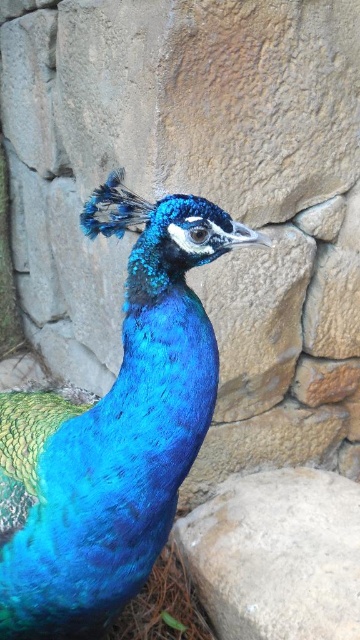
You are an artist trying to paint the scene. You need to decide which object to paint first based on their height. Which object should you start with, the shiny blue peacock at center or the gray rough stone at center?

The shiny blue peacock at center is taller than the gray rough stone at center, so you should start painting the shiny blue peacock at center first to ensure proper placement and proportions.

Based on the coordinates provided, where is the shiny blue peacock at center located in the image?

The shiny blue peacock at center is located at coordinates point [113,442].

You are a photographer holding a camera with a 20 inch long lens. You want to take a close up of the shiny blue peacock at center and the gray rough stone at center. Can you position the camera so that both are in focus without moving the camera? Explain why or why not.

The shiny blue peacock at center and gray rough stone at center are 30.20 inches apart. Since the camera lens is 20 inches long, it cannot focus on both objects simultaneously because the distance between them exceeds the lens length, making it impossible to capture both in focus without moving the camera.